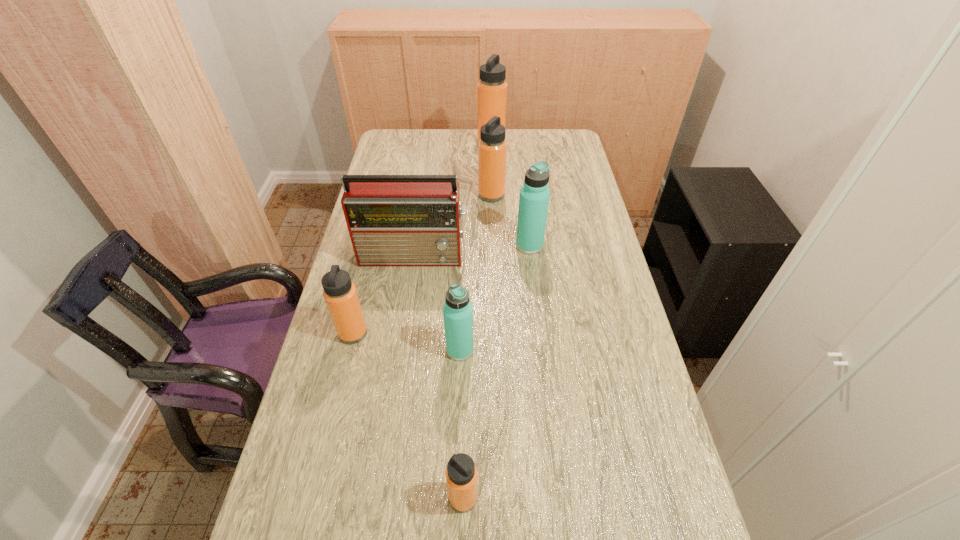
This screenshot has height=540, width=960. In order to click on vacant area that satisfies the following two spatial constraints: 1. on the front-facing side of the radio receiver; 2. on the right side of the shortest thermos bottle in this screenshot , I will do `click(377, 498)`.

Where is `vacant region that satisfies the following two spatial constraints: 1. on the front-facing side of the radio receiver; 2. on the right side of the smallest orange thermos bottle`? The image size is (960, 540). vacant region that satisfies the following two spatial constraints: 1. on the front-facing side of the radio receiver; 2. on the right side of the smallest orange thermos bottle is located at coordinates (377, 498).